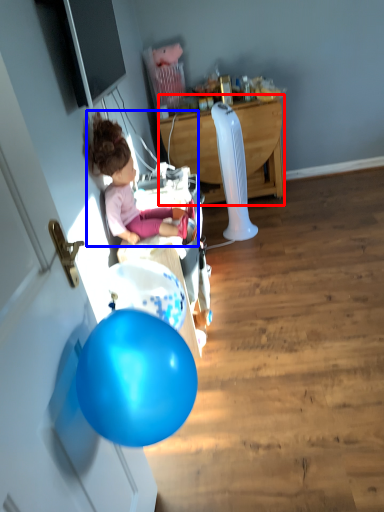
Question: Which object appears closest to the camera in this image, desk (highlighted by a red box) or person (highlighted by a blue box)?

Choices:
 (A) desk
 (B) person

Answer: (B)